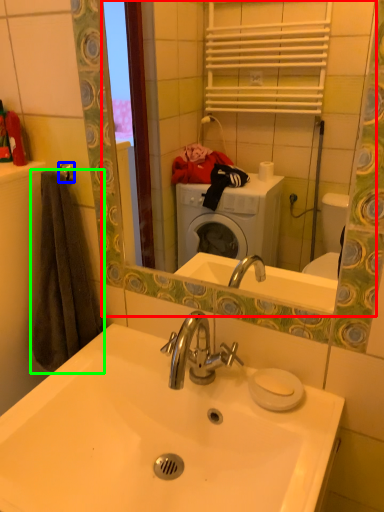
Question: Based on their relative distances, which object is farther from mirror (highlighted by a red box)? Choose from towel bar (highlighted by a blue box) and bath towel (highlighted by a green box).

Choices:
 (A) towel bar
 (B) bath towel

Answer: (A)